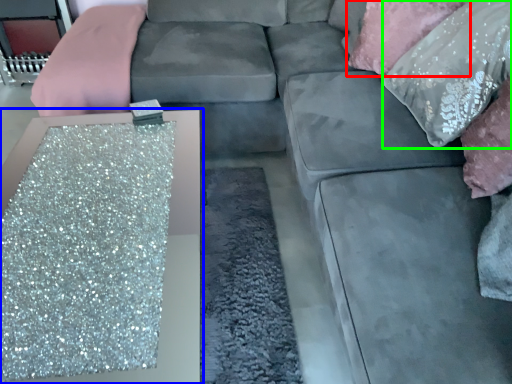
Question: Which is nearer to the pillow (highlighted by a red box)? table (highlighted by a blue box) or pillow (highlighted by a green box).

Choices:
 (A) table
 (B) pillow

Answer: (B)